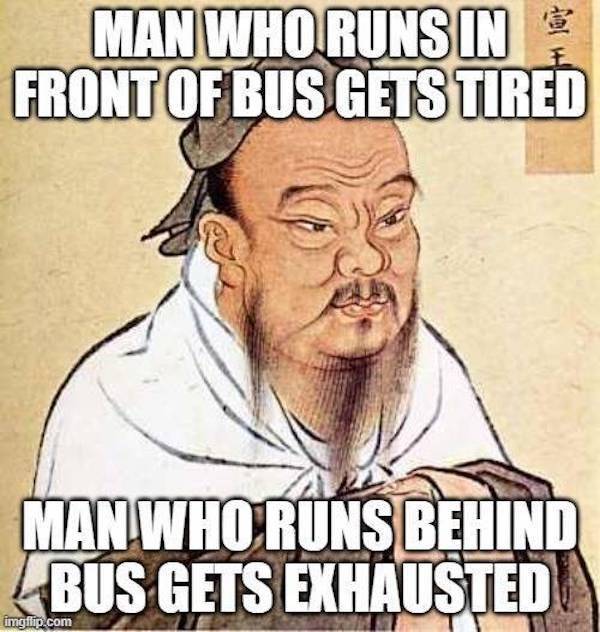
Where is `wall`? This screenshot has width=600, height=632. wall is located at coordinates (76, 260).